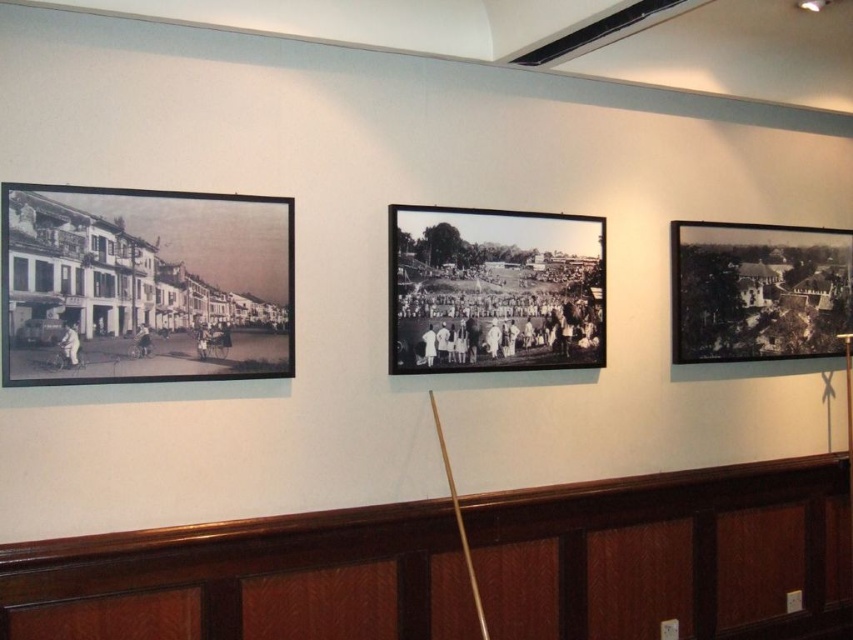
Who is taller, black paper at left or black paper at center?

black paper at center

Is black paper at left taller than black paper at center?

In fact, black paper at left may be shorter than black paper at center.

Which is in front, point (276, 273) or point (457, 362)?

Positioned in front is point (276, 273).

Locate an element on the screen. The height and width of the screenshot is (640, 853). black paper at left is located at coordinates (144, 285).

Is black paper at center positioned before black paper at right?

Yes, black paper at center is in front of black paper at right.

Who is taller, black paper at center or black paper at right?

black paper at right is taller.

This screenshot has width=853, height=640. What do you see at coordinates (494, 289) in the screenshot?
I see `black paper at center` at bounding box center [494, 289].

Identify the location of black paper at center. This screenshot has height=640, width=853. (494, 289).

The width and height of the screenshot is (853, 640). Describe the element at coordinates (144, 285) in the screenshot. I see `black paper at left` at that location.

Consider the image. Between black paper at left and black paper at right, which one has less height?

black paper at left is shorter.

At what (x,y) coordinates should I click in order to perform the action: click on black paper at left. Please return your answer as a coordinate pair (x, y). Looking at the image, I should click on (144, 285).